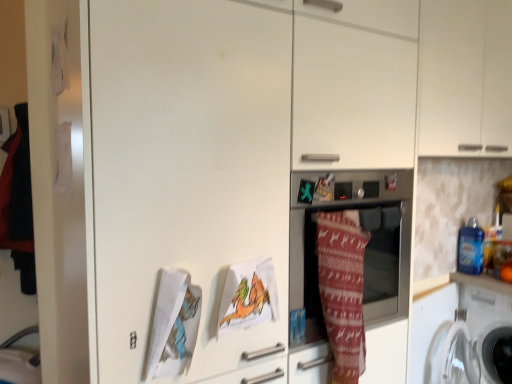
Question: Is knitted woolen blanket at center bigger than white matte cabinet at upper right?

Choices:
 (A) no
 (B) yes

Answer: (A)

Question: Is knitted woolen blanket at center aimed at white matte cabinet at upper right?

Choices:
 (A) yes
 (B) no

Answer: (B)

Question: Can you see knitted woolen blanket at center touching white matte cabinet at upper right?

Choices:
 (A) yes
 (B) no

Answer: (B)

Question: Can you confirm if knitted woolen blanket at center is shorter than white matte cabinet at upper right?

Choices:
 (A) yes
 (B) no

Answer: (A)

Question: From the image's perspective, is knitted woolen blanket at center over white matte cabinet at upper right?

Choices:
 (A) no
 (B) yes

Answer: (A)

Question: Considering the positions of knitted woolen blanket at center and white matte cabinet at upper right in the image, is knitted woolen blanket at center wider or thinner than white matte cabinet at upper right?

Choices:
 (A) thin
 (B) wide

Answer: (A)

Question: In terms of size, does knitted woolen blanket at center appear bigger or smaller than white matte cabinet at upper right?

Choices:
 (A) small
 (B) big

Answer: (A)

Question: In terms of height, does knitted woolen blanket at center look taller or shorter compared to white matte cabinet at upper right?

Choices:
 (A) tall
 (B) short

Answer: (B)

Question: Is knitted woolen blanket at center situated inside white matte cabinet at upper right or outside?

Choices:
 (A) inside
 (B) outside

Answer: (B)

Question: Is point (435, 375) closer or farther from the camera than point (462, 306)?

Choices:
 (A) farther
 (B) closer

Answer: (B)

Question: From the image's perspective, is white plastic washing machine at lower right, which is counted as the second washing machine, starting from the right, positioned above or below white plastic washing machine at lower right, the second washing machine when ordered from left to right?

Choices:
 (A) above
 (B) below

Answer: (A)

Question: Choose the correct answer: Is white plastic washing machine at lower right, which is counted as the second washing machine, starting from the right, inside white plastic washing machine at lower right, positioned as the 1th washing machine in right-to-left order, or outside it?

Choices:
 (A) outside
 (B) inside

Answer: (A)

Question: Looking at their shapes, would you say white plastic washing machine at lower right, which is counted as the second washing machine, starting from the right, is wider or thinner than white plastic washing machine at lower right, positioned as the 1th washing machine in right-to-left order?

Choices:
 (A) thin
 (B) wide

Answer: (A)

Question: Do you think white matte cabinet at upper right is within white plastic washing machine at lower right, positioned as the 1th washing machine in right-to-left order, or outside of it?

Choices:
 (A) inside
 (B) outside

Answer: (B)

Question: From their relative heights in the image, would you say white matte cabinet at upper right is taller or shorter than white plastic washing machine at lower right, the second washing machine when ordered from left to right?

Choices:
 (A) tall
 (B) short

Answer: (A)